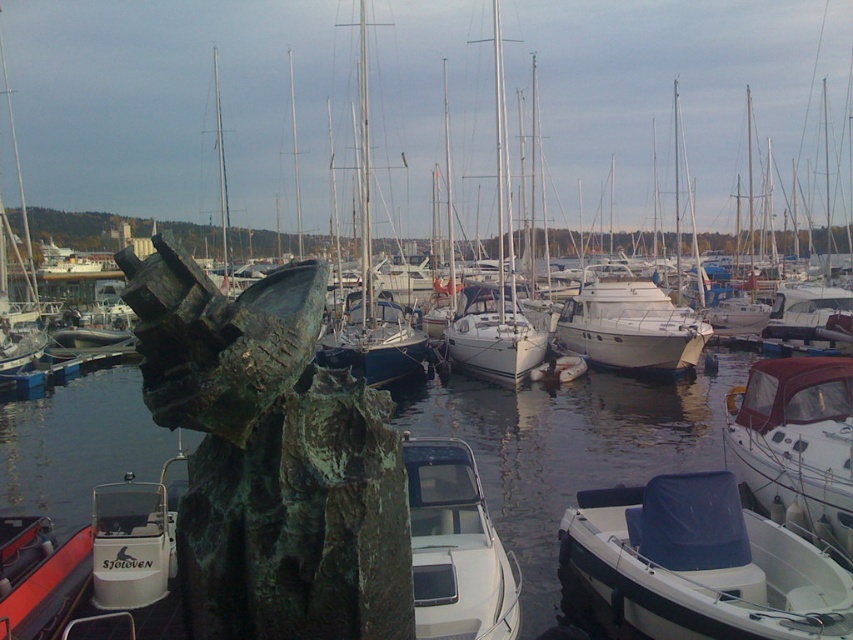
Is point (309, 401) positioned after point (703, 474)?

That is False.

Between green patina statue at center and white plastic boat at lower right, which one is positioned higher?

green patina statue at center is higher up.

Which is behind, point (350, 605) or point (801, 627)?

Positioned behind is point (801, 627).

Identify the location of green patina statue at center. This screenshot has width=853, height=640. (271, 458).

Between white plastic boat at lower right and white glossy boat at center, which one has more height?

Standing taller between the two is white plastic boat at lower right.

Can you confirm if white plastic boat at lower right is thinner than white glossy boat at center?

Incorrect, white plastic boat at lower right's width is not less than white glossy boat at center's.

I want to click on white plastic boat at lower right, so click(x=699, y=564).

Identify the location of white plastic boat at lower right. This screenshot has width=853, height=640. (699, 564).

Find the location of a particular element. green patina statue at center is located at coordinates (271, 458).

Which is behind, point (396, 632) or point (497, 609)?

Point (497, 609)

In order to click on green patina statue at center in this screenshot , I will do `click(271, 458)`.